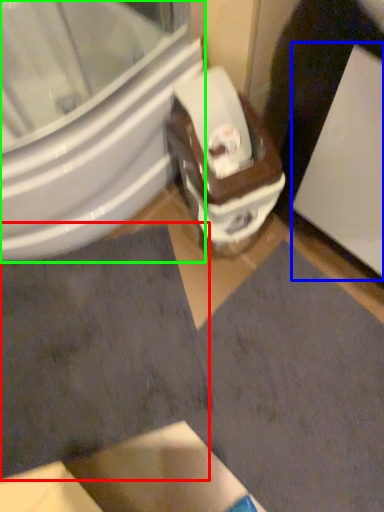
Question: Which object is positioned farthest from square (highlighted by a red box)? Select from screen door (highlighted by a blue box) and bidet (highlighted by a green box).

Choices:
 (A) screen door
 (B) bidet

Answer: (A)